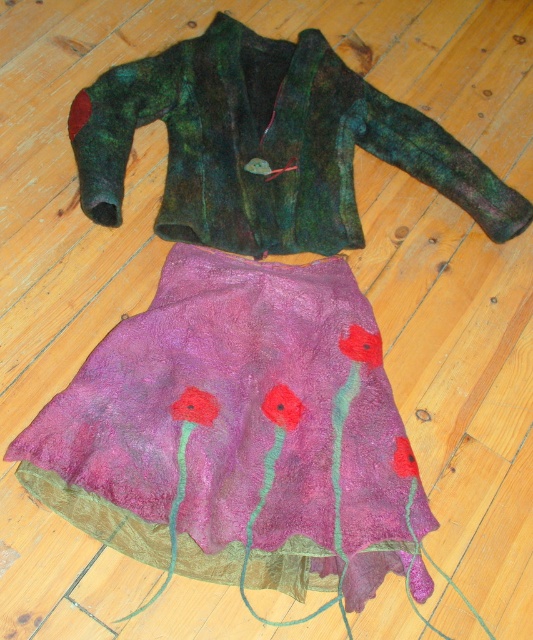
You are organizing a fashion show and need to arrange the purple felt skirt at center and the matte felt flower at center on a display table. If the table has limited space, which item should you prioritize placing first to ensure both fit?

The purple felt skirt at center has a larger size compared to the matte felt flower at center, so you should prioritize placing the purple felt skirt at center first to ensure both fit on the table.

You are organizing a craft fair and need to place the green felted jacket at upper center and the felted wool flower at center into boxes. The jacket box can hold items up to 1 meter in width, and the flower box can hold items up to 30 cm in width. Based on their sizes, will both items fit into their respective boxes?

The green felted jacket at upper center is larger than the felted wool flower at center. Since the jacket box can hold up to 1 meter and the flower box up to 30 cm, the jacket may fit if its width is under 1 meter, but the flower must be under 30 cm. However, without exact measurements, we can only confirm the flower likely fits if it is smaller than the jacket. The jacket might also fit depending on its actual size.

Based on the photo, you are an interior designer arranging two flowers on a table. You have a vibrant red felt flower at center and a felted wool flower at center. According to the image, which flower should you place higher to match the arrangement seen in the scene?

The vibrant red felt flower at center should be placed higher because it has a greater height compared to the felted wool flower at center according to the scene description.